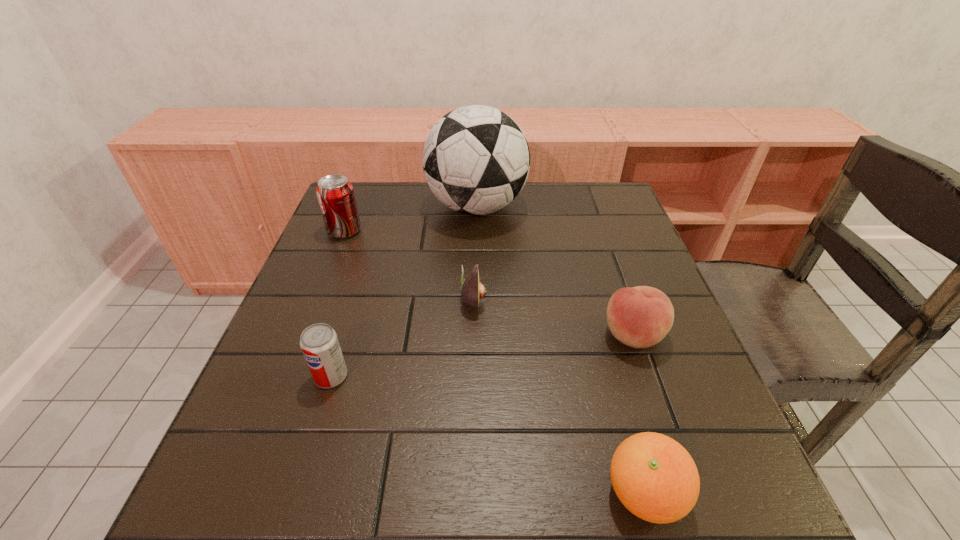
Locate an element on the screen. The image size is (960, 540). vacant area between the leftmost object and the soccer ball is located at coordinates (411, 219).

Identify the location of free spot between the fifth farthest object and the nearest object. (488, 435).

This screenshot has height=540, width=960. Identify the location of vacant point located between the second tallest object and the right soda. (338, 303).

Find the location of `free spot between the nearest object and the avocado`. free spot between the nearest object and the avocado is located at coordinates (559, 397).

Image resolution: width=960 pixels, height=540 pixels. I want to click on vacant area that lies between the peach and the tallest object, so (x=555, y=272).

This screenshot has width=960, height=540. I want to click on unoccupied position between the leftmost object and the shorter soda, so click(338, 303).

This screenshot has width=960, height=540. I want to click on vacant area that lies between the peach and the right soda, so click(482, 356).

Where is `object that can be found as the third closest to the farther soda`? Image resolution: width=960 pixels, height=540 pixels. object that can be found as the third closest to the farther soda is located at coordinates (319, 343).

Locate which object ranks fifth in proximity to the orange. Please provide its 2D coordinates. Your answer should be formatted as a tuple, i.e. [(x, y)], where the tuple contains the x and y coordinates of a point satisfying the conditions above.

[(335, 194)]

This screenshot has height=540, width=960. In order to click on vacant space that satisfies the following two spatial constraints: 1. on the front side of the orange; 2. on the left side of the second tallest object in this screenshot , I will do `click(239, 494)`.